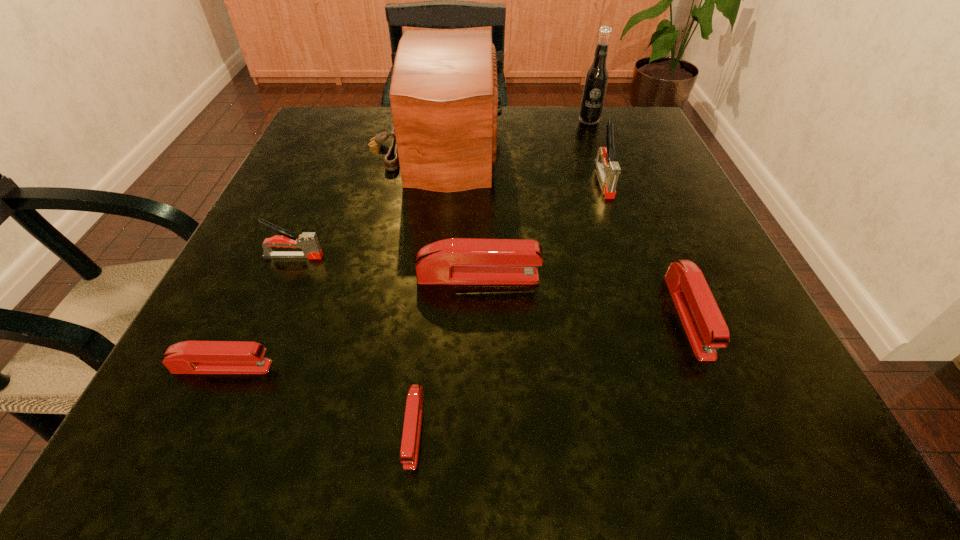
Where is `radio receiver`? radio receiver is located at coordinates (444, 98).

You are a GUI agent. You are given a task and a screenshot of the screen. Output one action in this format:
    pyautogui.click(x=<x>, y=<y>)
    Task: Click on the root beer
    The image size is (960, 540).
    Given the screenshot: What is the action you would take?
    pyautogui.click(x=596, y=79)

Where is `the bigger gray stapler`? Image resolution: width=960 pixels, height=540 pixels. the bigger gray stapler is located at coordinates (608, 170).

The image size is (960, 540). Identify the location of the right gray stapler. (608, 170).

The width and height of the screenshot is (960, 540). I want to click on the left gray stapler, so click(x=307, y=241).

The image size is (960, 540). I want to click on the nearer gray stapler, so click(x=307, y=241).

Identify the location of the biggest red stapler. The width and height of the screenshot is (960, 540). (456, 260).

Find the location of `the rightmost object`. the rightmost object is located at coordinates (706, 329).

Find the location of a particular element. This screenshot has width=960, height=540. the rightmost red stapler is located at coordinates (706, 329).

Identify the location of the second smallest red stapler. (189, 357).